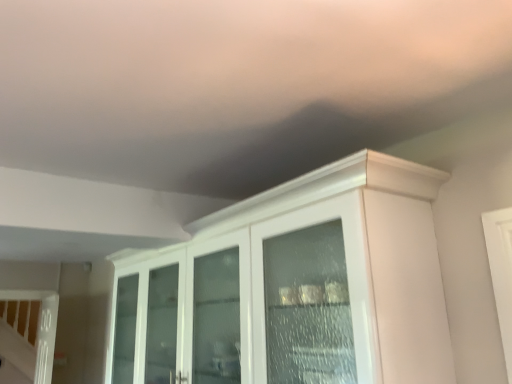
Where is `white glossy cupboard at upper center`? This screenshot has width=512, height=384. white glossy cupboard at upper center is located at coordinates (294, 287).

This screenshot has width=512, height=384. What do you see at coordinates (294, 287) in the screenshot?
I see `white glossy cupboard at upper center` at bounding box center [294, 287].

In order to click on white glossy cupboard at upper center in this screenshot , I will do `click(294, 287)`.